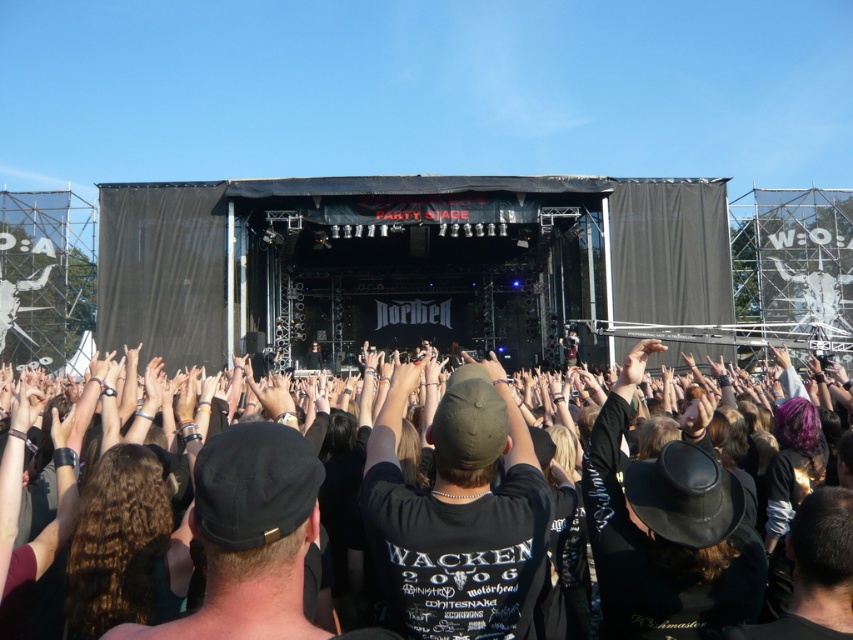
Does black fabric crowd at center have a lesser width compared to black matte cap at center?

No, black fabric crowd at center is not thinner than black matte cap at center.

Which is above, black fabric crowd at center or black matte cap at center?

black fabric crowd at center is above.

Is point (300, 444) closer to camera compared to point (469, 396)?

Yes, it is in front of point (469, 396).

This screenshot has height=640, width=853. Find the location of `black fabric crowd at center`. black fabric crowd at center is located at coordinates pos(457,512).